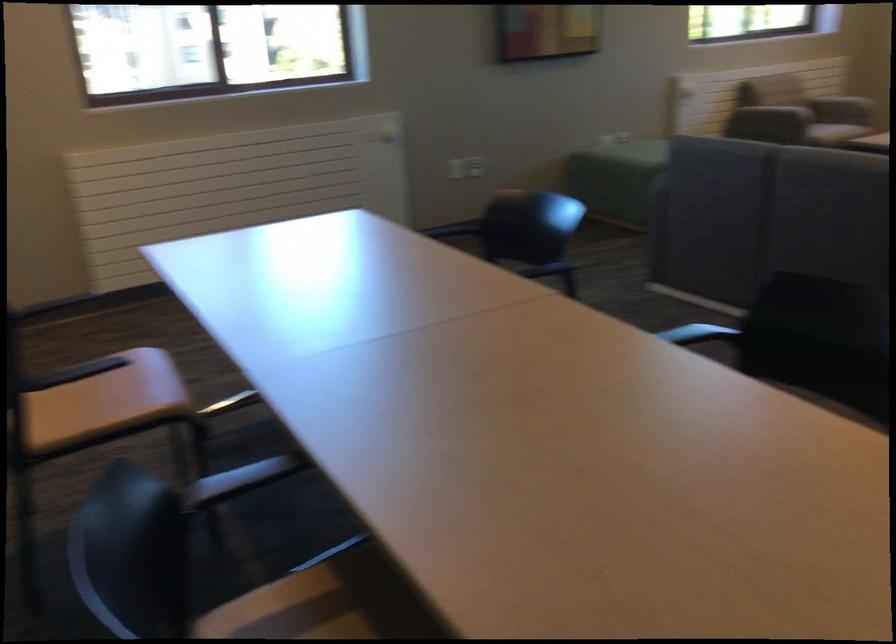
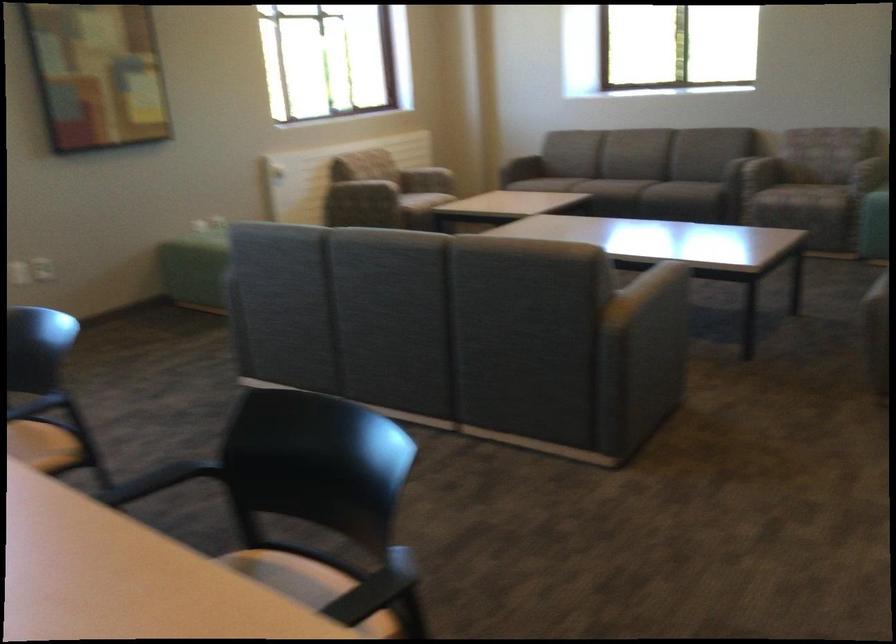
Question: The images are taken continuously from a first-person perspective. In which direction are you moving?

Choices:
 (A) Left
 (B) Right
 (C) Forward
 (D) Backward

Answer: (B)